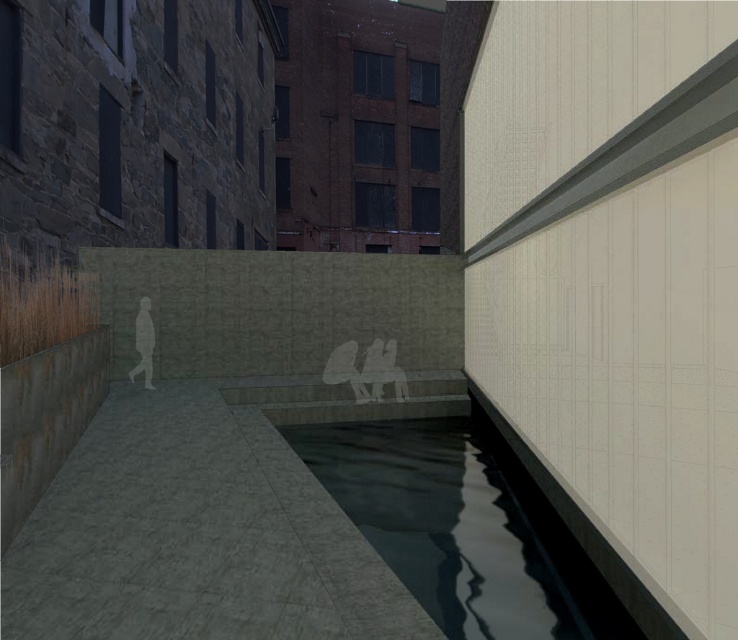
Question: Is dark reflective water at center to the left of silhouette figure at center from the viewer's perspective?

Choices:
 (A) no
 (B) yes

Answer: (A)

Question: Does dark reflective water at center have a smaller size compared to silhouette figure at center?

Choices:
 (A) yes
 (B) no

Answer: (B)

Question: Can you confirm if dark reflective water at center is positioned to the right of silhouette figure at center?

Choices:
 (A) yes
 (B) no

Answer: (A)

Question: Which point appears farthest from the camera in this image?

Choices:
 (A) (142, 324)
 (B) (430, 552)

Answer: (A)